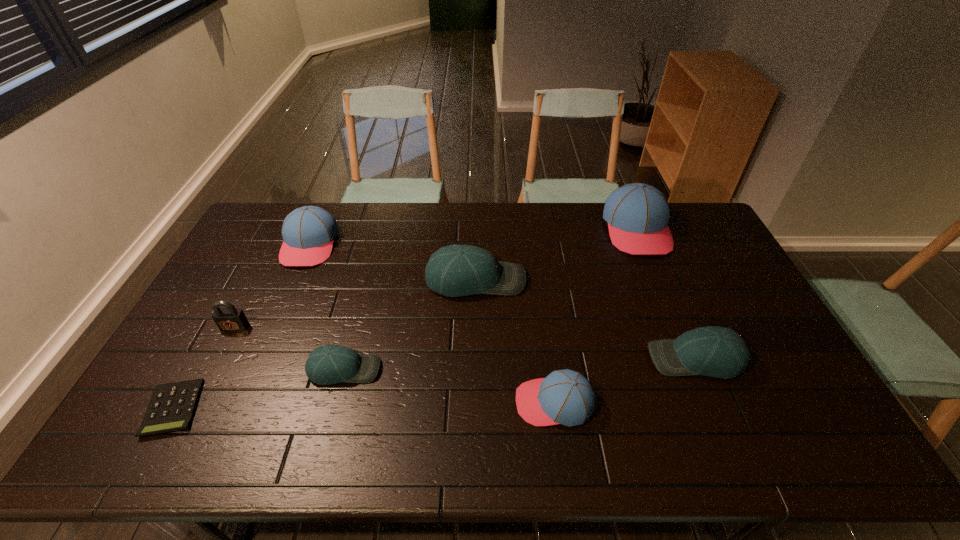
Find the location of a particular element. This screenshot has height=540, width=960. vacant space situated 0.300m on the front-facing side of the nearest blue baseball cap is located at coordinates (397, 402).

Image resolution: width=960 pixels, height=540 pixels. I want to click on vacant space located on the front-facing side of the nearest blue baseball cap, so click(382, 402).

I want to click on free location located on the left of the shortest baseball cap, so click(x=223, y=369).

Locate an element on the screen. The image size is (960, 540). free point located 0.060m on the back of the calculator is located at coordinates (199, 361).

At what (x,y) coordinates should I click in order to perform the action: click on baseball cap that is at the near edge. Please return your answer as a coordinate pair (x, y). The width and height of the screenshot is (960, 540). Looking at the image, I should click on (566, 397).

This screenshot has height=540, width=960. Identify the location of calculator that is at the near edge. (172, 406).

Where is `baseball cap that is at the left edge`? baseball cap that is at the left edge is located at coordinates (308, 232).

Find the location of a particular element. Image resolution: width=960 pixels, height=540 pixels. padlock that is at the left edge is located at coordinates (230, 319).

Image resolution: width=960 pixels, height=540 pixels. What are the coordinates of `calculator that is at the left edge` in the screenshot? It's located at (172, 406).

The height and width of the screenshot is (540, 960). What are the coordinates of `object at the far left corner` in the screenshot? It's located at (308, 232).